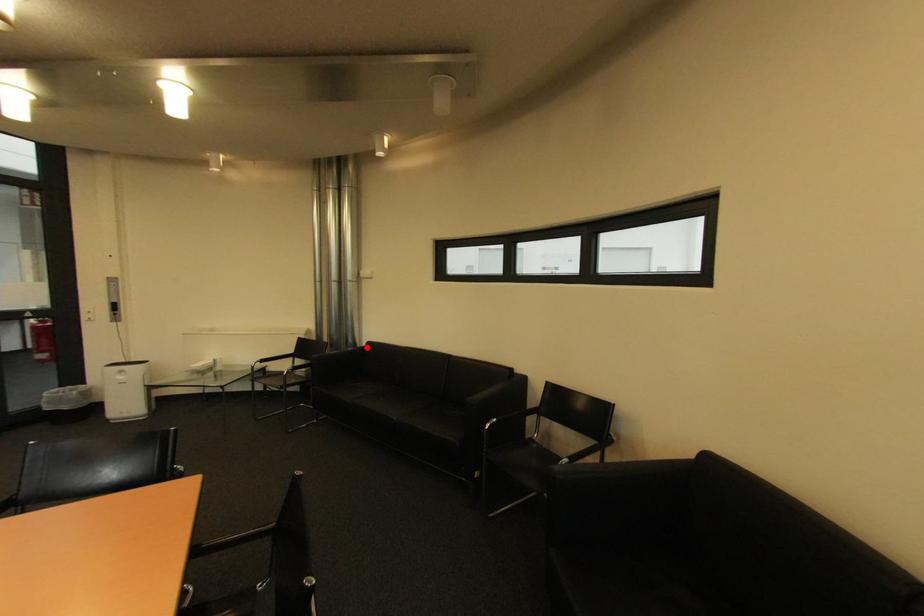
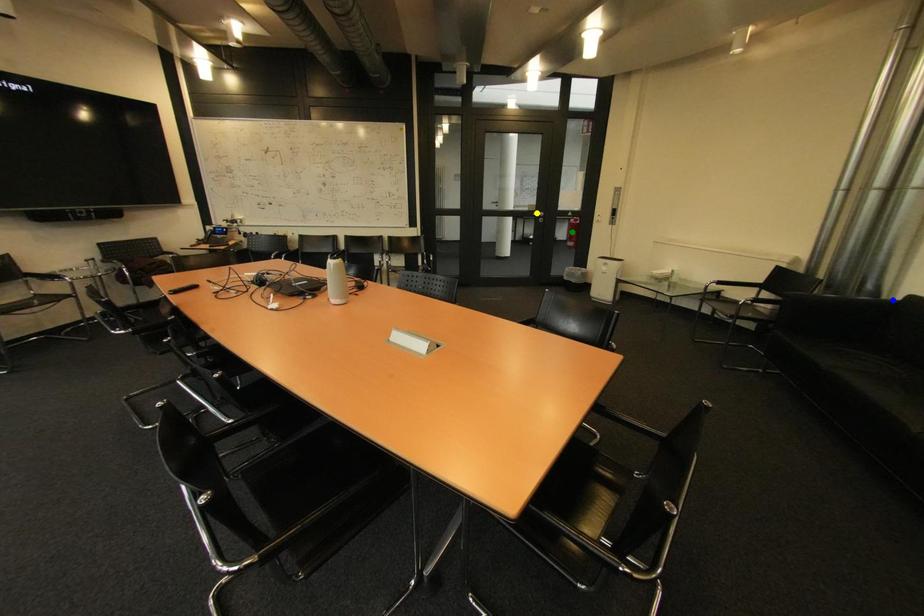
Question: I am providing you with two images of the same scene from different viewpoints. A red point is marked on the first image. You are given multiple points on the second image. Which point in image 2 is actually the same real-world point as the red point in image 1?

Choices:
 (A) blue point
 (B) green point
 (C) yellow point

Answer: (A)